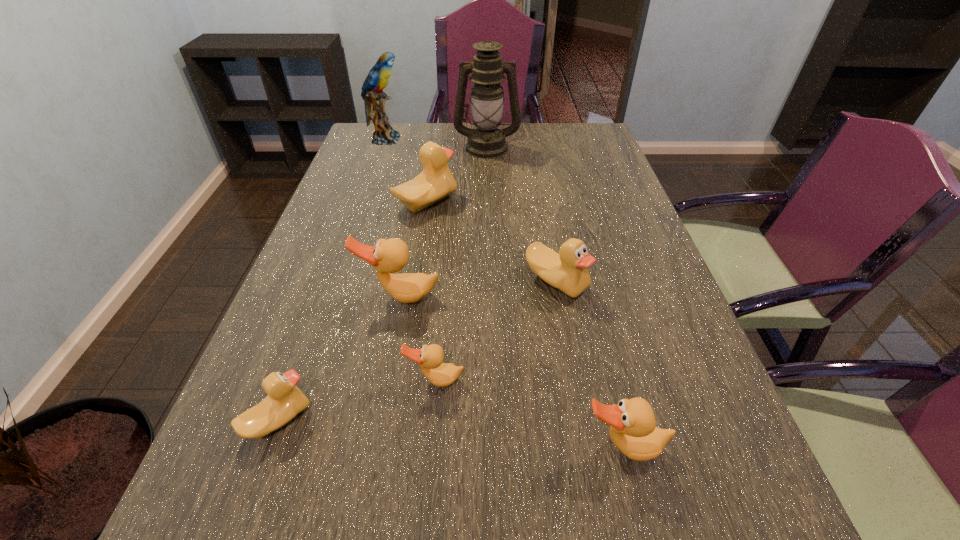
Locate an element on the screen. The height and width of the screenshot is (540, 960). oil lamp is located at coordinates (487, 70).

This screenshot has width=960, height=540. Find the location of `parrot`. parrot is located at coordinates (378, 77).

Identify the location of the farthest duck. (436, 182).

Where is `the biggest beige duck`? This screenshot has width=960, height=540. the biggest beige duck is located at coordinates (436, 182).

What are the coordinates of `the farthest tan duck` in the screenshot? It's located at tap(388, 256).

The height and width of the screenshot is (540, 960). I want to click on the second biggest beige duck, so click(567, 271).

Image resolution: width=960 pixels, height=540 pixels. I want to click on the rightmost beige duck, so click(567, 271).

Where is `the nearest tan duck`? The image size is (960, 540). the nearest tan duck is located at coordinates (633, 430).

I want to click on the second smallest tan duck, so click(x=633, y=430).

Where is `the nearest beige duck`? Image resolution: width=960 pixels, height=540 pixels. the nearest beige duck is located at coordinates (285, 400).